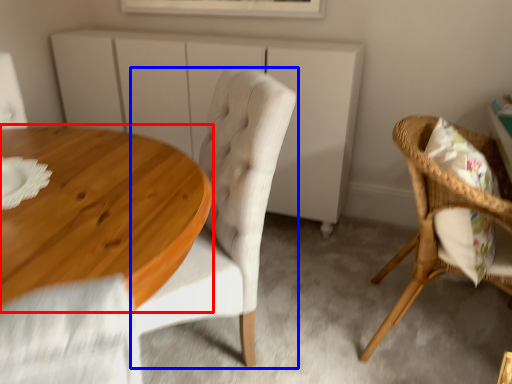
Question: Which object is further to the camera taking this photo, coffee table (highlighted by a red box) or chair (highlighted by a blue box)?

Choices:
 (A) coffee table
 (B) chair

Answer: (B)